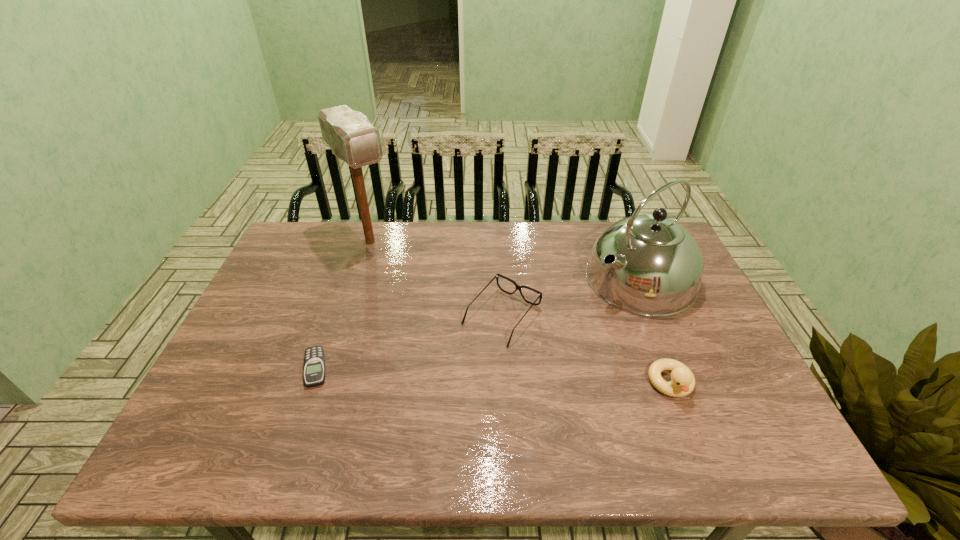
Locate an element on the screen. This screenshot has height=540, width=960. free space on the desktop that is between the shortest object and the duckling and is positioned on the striking face of the tallest object is located at coordinates (483, 375).

The image size is (960, 540). Find the location of `free space on the desktop that is between the beeper and the duckling and is positioned from the spout of the kettle`. free space on the desktop that is between the beeper and the duckling and is positioned from the spout of the kettle is located at coordinates (479, 375).

In order to click on vacant spot on the desktop that is between the beeper and the duckling and is positioned with the lenses facing outward on the fourth tallest object in this screenshot , I will do `click(450, 374)`.